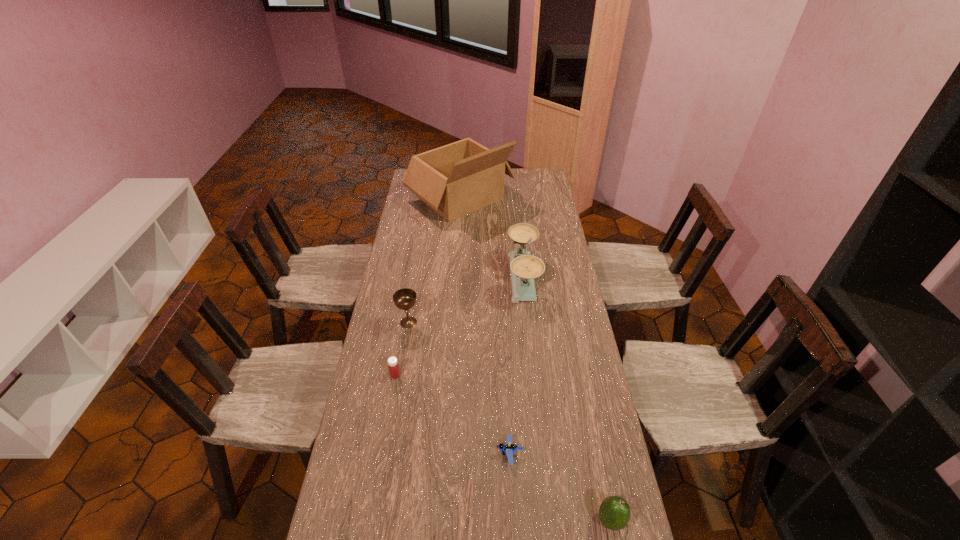
This screenshot has width=960, height=540. Find the location of `box`. box is located at coordinates (454, 180).

I want to click on the tallest object, so click(x=454, y=180).

I want to click on the fifth shortest object, so click(x=525, y=267).

I want to click on scale, so click(525, 267).

At what (x,y) coordinates should I click in order to perform the action: click on the fourth shortest object. Please return your answer as a coordinate pair (x, y). This screenshot has height=540, width=960. Looking at the image, I should click on (404, 299).

Locate an element on the screen. Image resolution: width=960 pixels, height=540 pixels. chalice is located at coordinates (404, 299).

The image size is (960, 540). What are the coordinates of `avocado` in the screenshot? It's located at (614, 512).

Where is `the nearest object`? Image resolution: width=960 pixels, height=540 pixels. the nearest object is located at coordinates click(614, 512).

You are a GUI agent. You are given a task and a screenshot of the screen. Output one action in this format:
    pyautogui.click(x=<x>, y=<y>)
    Task: Click on the medicine
    The height and width of the screenshot is (540, 960).
    Given the screenshot: What is the action you would take?
    393,366

Locate an element on the screen. This screenshot has width=960, height=540. the fourth farthest object is located at coordinates (393, 366).